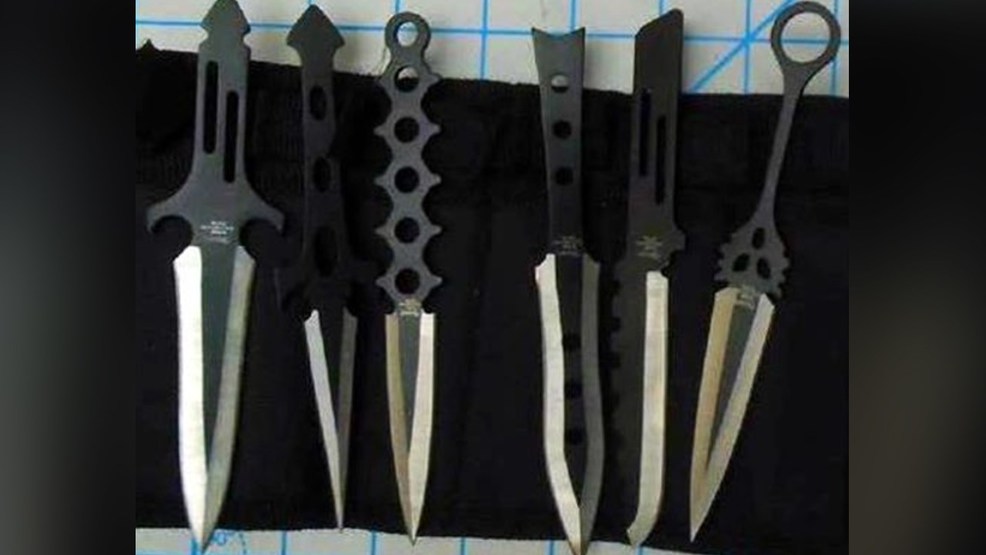
This screenshot has height=555, width=986. I want to click on curved handle, so click(x=255, y=216), click(x=179, y=216).